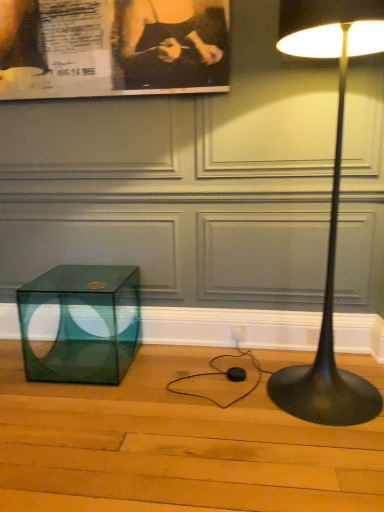
Question: From a real-world perspective, is black paper at upper left located beneath black matte floor lamp at right?

Choices:
 (A) yes
 (B) no

Answer: (B)

Question: Can you confirm if black paper at upper left is taller than black matte floor lamp at right?

Choices:
 (A) yes
 (B) no

Answer: (B)

Question: Is black paper at upper left facing towards black matte floor lamp at right?

Choices:
 (A) no
 (B) yes

Answer: (A)

Question: From the image's perspective, is black paper at upper left under black matte floor lamp at right?

Choices:
 (A) no
 (B) yes

Answer: (A)

Question: Is there a large distance between black paper at upper left and black matte floor lamp at right?

Choices:
 (A) no
 (B) yes

Answer: (A)

Question: Can you confirm if black paper at upper left is smaller than black matte floor lamp at right?

Choices:
 (A) yes
 (B) no

Answer: (A)

Question: Is black paper at upper left not close to transparent glass cube at lower left?

Choices:
 (A) no
 (B) yes

Answer: (B)

Question: Is black paper at upper left wider than transparent glass cube at lower left?

Choices:
 (A) yes
 (B) no

Answer: (B)

Question: Does black paper at upper left appear on the right side of transparent glass cube at lower left?

Choices:
 (A) no
 (B) yes

Answer: (B)

Question: Would you say transparent glass cube at lower left is part of black paper at upper left's contents?

Choices:
 (A) yes
 (B) no

Answer: (B)

Question: Considering the relative positions of black paper at upper left and transparent glass cube at lower left in the image provided, is black paper at upper left to the left of transparent glass cube at lower left from the viewer's perspective?

Choices:
 (A) yes
 (B) no

Answer: (B)

Question: From a real-world perspective, is black paper at upper left on transparent glass cube at lower left?

Choices:
 (A) yes
 (B) no

Answer: (A)

Question: Considering the relative sizes of black matte floor lamp at right and black paper at upper left in the image provided, is black matte floor lamp at right smaller than black paper at upper left?

Choices:
 (A) yes
 (B) no

Answer: (B)